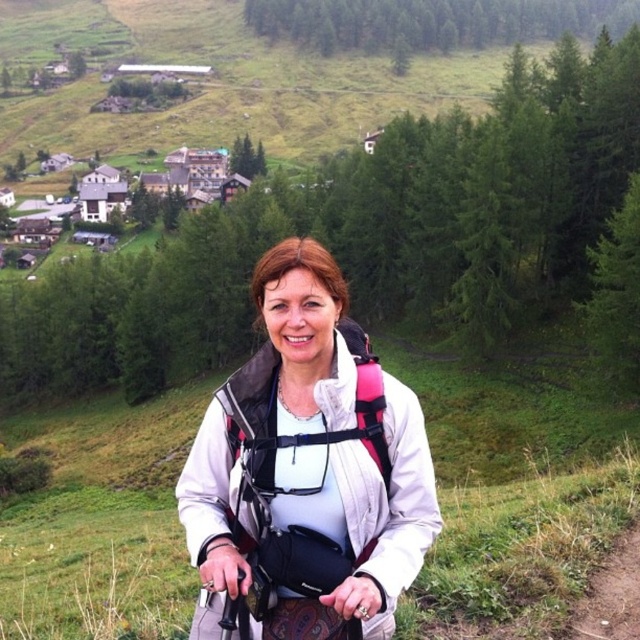
You are a drone operator planning to fly a drone from the point at (328, 508) to the point at (324, 436). Considering the terrain, which point is closer to you and will the drone have to ascend or descend to reach the other point?

Point (328, 508) is closer to the viewer. To reach point (324, 436), the drone will have to ascend because it is farther away and likely at a higher elevation.

You are standing at the point marked as point (328, 572) in the image. A friend is at your location and wants to walk towards the camera. How far will they have to walk to reach the camera?

The point (328, 572) is 13.72 meters away from the viewer, so your friend would need to walk 13.72 meters to reach the camera.

You are a hiker who just arrived at the scenic spot and want to check your gear. You have a 28 inch backpack with you. Can you determine if the distance between the white matte jacket at center and the pink fabric strap at center is enough to comfortably fit your backpack between them?

The distance between the white matte jacket at center and the pink fabric strap at center is 30.78 inches, which is slightly longer than your 28 inch backpack. This should provide enough space to comfortably fit your backpack between them.